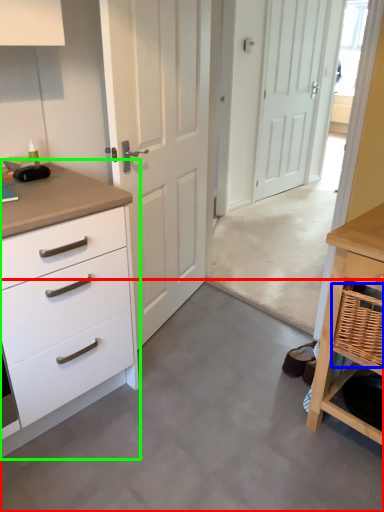
Question: Estimate the real-world distances between objects in this image. Which object is farther from concrete (highlighted by a red box), basket (highlighted by a blue box) or chest of drawers (highlighted by a green box)?

Choices:
 (A) basket
 (B) chest of drawers

Answer: (A)